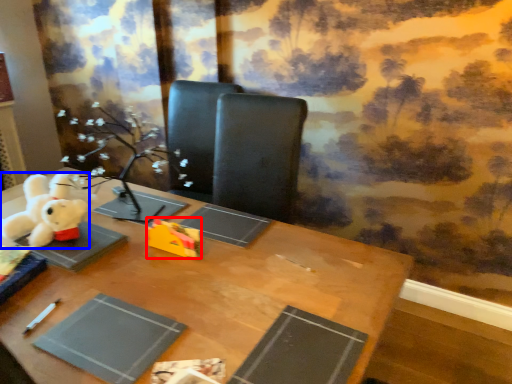
Question: Which of the following is the closest to the observer, toy (highlighted by a red box) or toy (highlighted by a blue box)?

Choices:
 (A) toy
 (B) toy

Answer: (B)